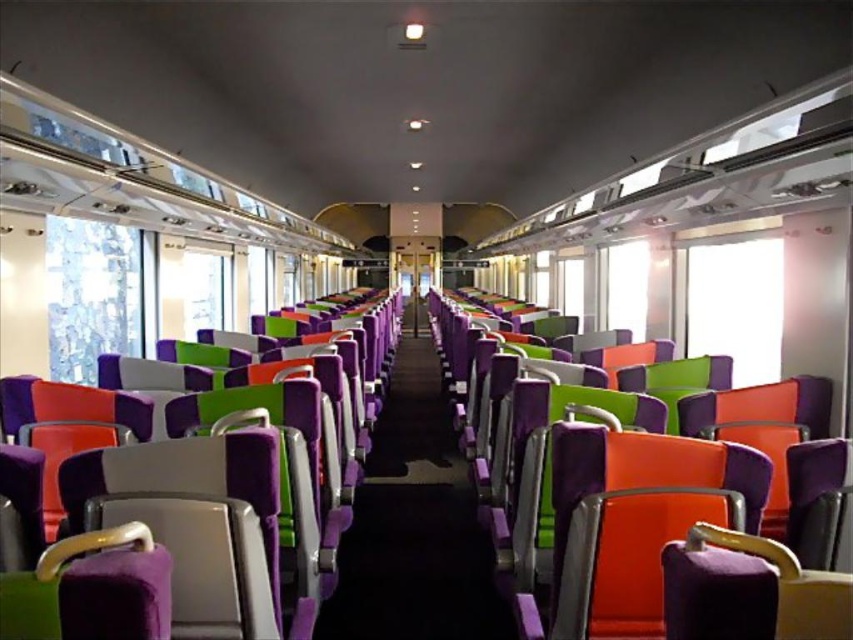
Question: Which of the following is the farthest from the observer?

Choices:
 (A) (573, 618)
 (B) (155, 621)

Answer: (A)

Question: Which object is farther from the camera taking this photo?

Choices:
 (A) purple fabric seat at left
 (B) purple fabric seat at center

Answer: (B)

Question: Is purple fabric seat at left below purple fabric seat at center?

Choices:
 (A) no
 (B) yes

Answer: (B)

Question: Is purple fabric seat at left to the left of purple fabric seat at center from the viewer's perspective?

Choices:
 (A) no
 (B) yes

Answer: (B)

Question: Can you confirm if purple fabric seat at left is positioned below purple fabric seat at center?

Choices:
 (A) yes
 (B) no

Answer: (A)